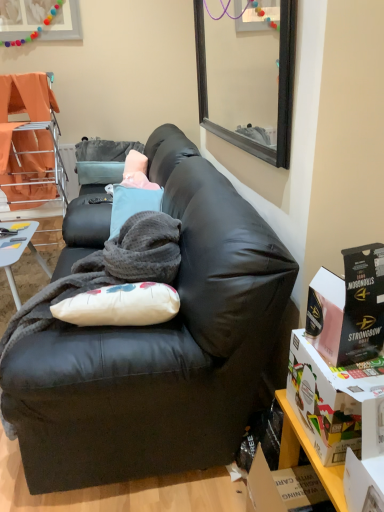
Question: Is light blue plastic desk at lower left taller or shorter than soft gray blanket at center?

Choices:
 (A) tall
 (B) short

Answer: (B)

Question: Would you say light blue plastic desk at lower left is to the left or to the right of soft gray blanket at center in the picture?

Choices:
 (A) right
 (B) left

Answer: (B)

Question: Estimate the real-world distances between objects in this image. Which object is closer to the light blue plastic desk at lower left?

Choices:
 (A) matte black couch at center
 (B) wooden shelf at lower right
 (C) matte cardboard box at lower right, arranged as the first box when ordered from the bottom
 (D) matte black box at right, which is the second box from bottom to top
 (E) soft gray blanket at center

Answer: (E)

Question: Considering the real-world distances, which object is farthest from the matte cardboard box at lower right, arranged as the first box when ordered from the bottom?

Choices:
 (A) light blue plastic desk at lower left
 (B) matte black couch at center
 (C) soft gray blanket at center
 (D) matte black box at right, marked as the 1th box in a top-to-bottom arrangement
 (E) wooden shelf at lower right

Answer: (A)